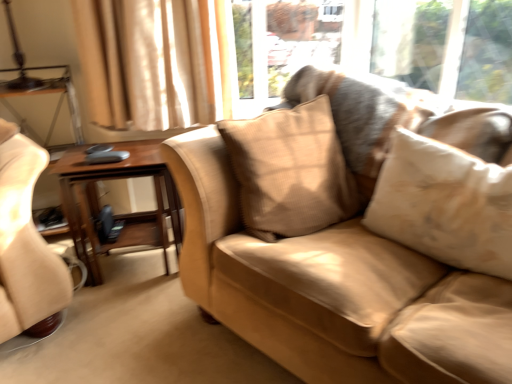
Question: Is beige textured pillow at center, the 1th pillow when ordered from left to right, turned away from woodenmaterial/texturetable at left?

Choices:
 (A) no
 (B) yes

Answer: (B)

Question: Is beige textured pillow at center, the second pillow in the right-to-left sequence, shorter than woodenmaterial/texturetable at left?

Choices:
 (A) no
 (B) yes

Answer: (B)

Question: Is beige textured pillow at center, the 1th pillow when ordered from left to right, aimed at woodenmaterial/texturetable at left?

Choices:
 (A) yes
 (B) no

Answer: (B)

Question: Is beige textured pillow at center, the 1th pillow when ordered from left to right, further to camera compared to woodenmaterial/texturetable at left?

Choices:
 (A) no
 (B) yes

Answer: (A)

Question: Considering the relative sizes of beige textured pillow at center, the second pillow in the right-to-left sequence, and woodenmaterial/texturetable at left in the image provided, is beige textured pillow at center, the second pillow in the right-to-left sequence, thinner than woodenmaterial/texturetable at left?

Choices:
 (A) no
 (B) yes

Answer: (B)

Question: In terms of size, does beige textured pillow at center, the second pillow in the right-to-left sequence, appear bigger or smaller than suede-like beige couch at center?

Choices:
 (A) small
 (B) big

Answer: (A)

Question: Visually, is beige textured pillow at center, the second pillow in the right-to-left sequence, positioned to the left or to the right of suede-like beige couch at center?

Choices:
 (A) left
 (B) right

Answer: (A)

Question: Is point (280, 213) closer or farther from the camera than point (324, 134)?

Choices:
 (A) farther
 (B) closer

Answer: (B)

Question: From the image's perspective, is beige textured pillow at center, the second pillow in the right-to-left sequence, positioned above or below suede-like beige couch at center?

Choices:
 (A) below
 (B) above

Answer: (B)

Question: Based on their sizes in the image, would you say beige textured pillow at center, the 1th pillow from the right, is bigger or smaller than suede-like beige couch at center?

Choices:
 (A) small
 (B) big

Answer: (A)

Question: Considering the positions of point (408, 137) and point (391, 243), is point (408, 137) closer or farther from the camera than point (391, 243)?

Choices:
 (A) farther
 (B) closer

Answer: (A)

Question: From a real-world perspective, is beige textured pillow at center, the 1th pillow from the right, above or below suede-like beige couch at center?

Choices:
 (A) above
 (B) below

Answer: (A)

Question: From the image's perspective, is beige textured pillow at center, the 1th pillow from the right, located above or below suede-like beige couch at center?

Choices:
 (A) above
 (B) below

Answer: (A)

Question: Considering the positions of suede-like beige couch at center and beige textured pillow at center, placed as the second pillow when sorted from left to right, in the image, is suede-like beige couch at center wider or thinner than beige textured pillow at center, placed as the second pillow when sorted from left to right,?

Choices:
 (A) thin
 (B) wide

Answer: (B)

Question: Is suede-like beige couch at center to the left or to the right of beige textured pillow at center, placed as the second pillow when sorted from left to right, in the image?

Choices:
 (A) left
 (B) right

Answer: (A)